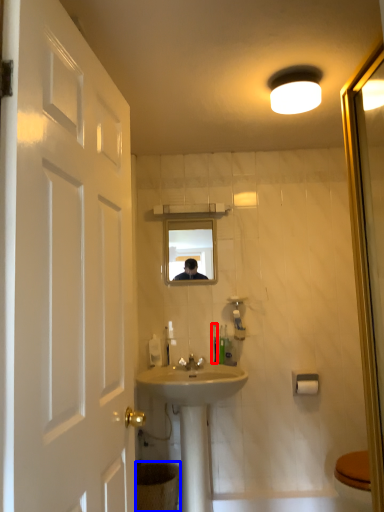
Question: Which of the following is the closest to the observer, toothbrush (highlighted by a red box) or toilet bowl (highlighted by a blue box)?

Choices:
 (A) toothbrush
 (B) toilet bowl

Answer: (B)